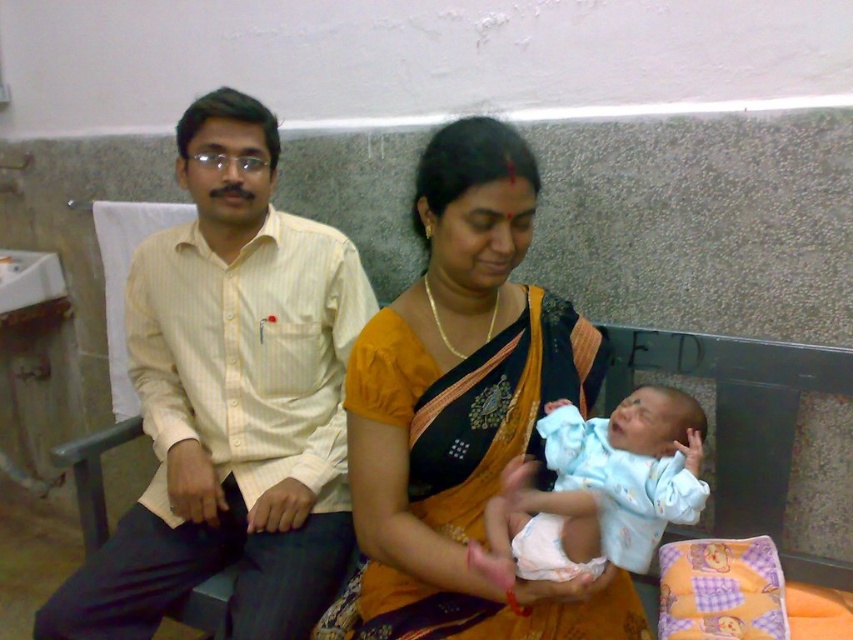
You are a photographer setting up a tripod to take a photo of the yellow striped shirt at left and the light blue fabric baby at center. The tripod can only focus on objects above 1 meter in height. Based on the scene description, will both subjects be in focus?

The yellow striped shirt at left is taller than the light blue fabric baby at center. Since the tripod focuses on objects above 1 meter, and the shirt is taller than the baby, it depends on the actual height of the shirt. If the shirt itself is over 1 meter tall, then both would be in focus. However, if the shirt is shorter than 1 meter, only the shirt might not be in focus. But since the baby is shorter than the shirt, if the shirt is above 1m, the baby might also be above 1m. Wait, this is confusing. Let

You are a healthcare worker in this hospital setting. You need to place two medical supplies at the two points given. The first point is point (421,362) and the second is point (553,579). According to the spatial arrangement, which point is located behind the other?

Point (421,362) is behind point (553,579), so the first point is behind the second one.

You are a photographer taking a picture of the scene. You notice two points marked in the image. The first point is at coordinate point [131,323] and the second is at point [630,608]. Which point is closer to your camera?

Point [131,323] is further to the camera than point [630,608]. Therefore, point [630,608] is closer to the camera.